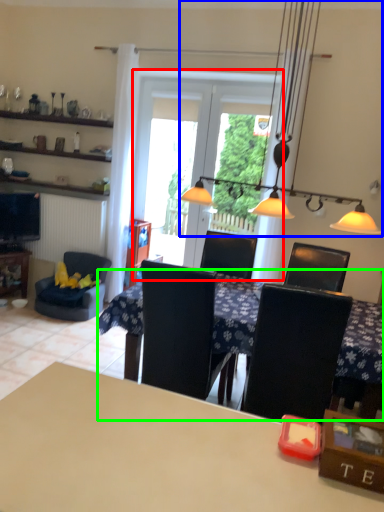
Question: Which object is the farthest from screen door (highlighted by a red box)? Choose among these: light fixture (highlighted by a blue box) or table (highlighted by a green box).

Choices:
 (A) light fixture
 (B) table

Answer: (B)